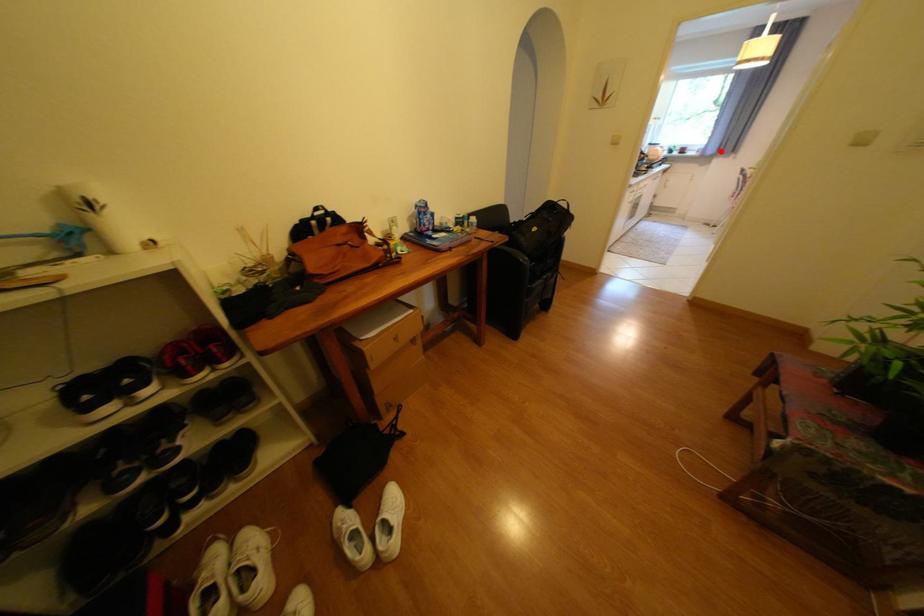
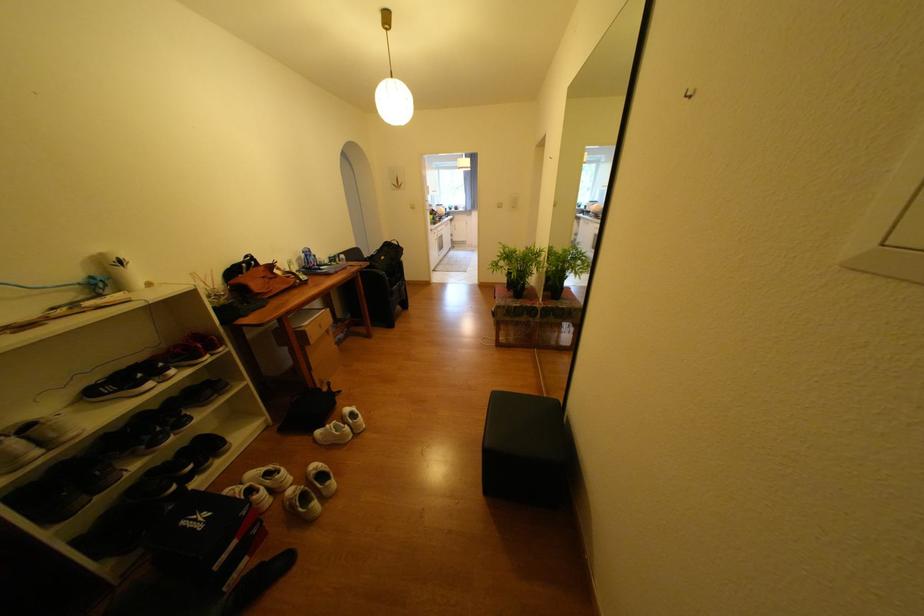
Question: I am providing you with two images of the same scene from different viewpoints. Image1 has a red point marked. In image2, the corresponding 3D location appears at what relative position? Reply with the corresponding letter.

Choices:
 (A) Closer
 (B) Farther

Answer: (A)